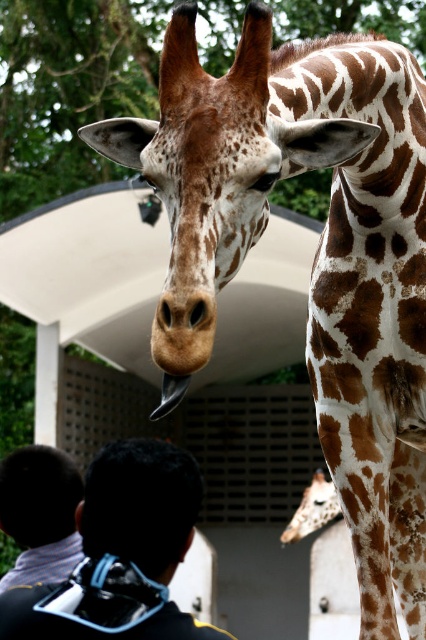
In the scene shown: You are a photographer trying to capture a clear shot of both the dark brown hair at lower left and the spotted fur at center. Which object should you focus on first to ensure both are in focus?

You should focus on the dark brown hair at lower left first since it is closer to the viewer than the spotted fur at center. By focusing on the closer object, you can ensure both are in focus using the depth of field.

You are a zookeeper trying to identify an object in the giraffe enclosure. You see the black matte mask at upper center and the spotted fur at center. Which object is closer to you?

The black matte mask at upper center is closer to you because it is in front of the spotted fur at center.

You are a photographer trying to capture a photo of the spotted fur at center and the dark brown hair at lower left. Which object should you focus on first if you want to include both in your frame without moving the camera?

You should focus on the spotted fur at center first since it is closer to the camera than the dark brown hair at lower left, allowing both to be in the frame more effectively.